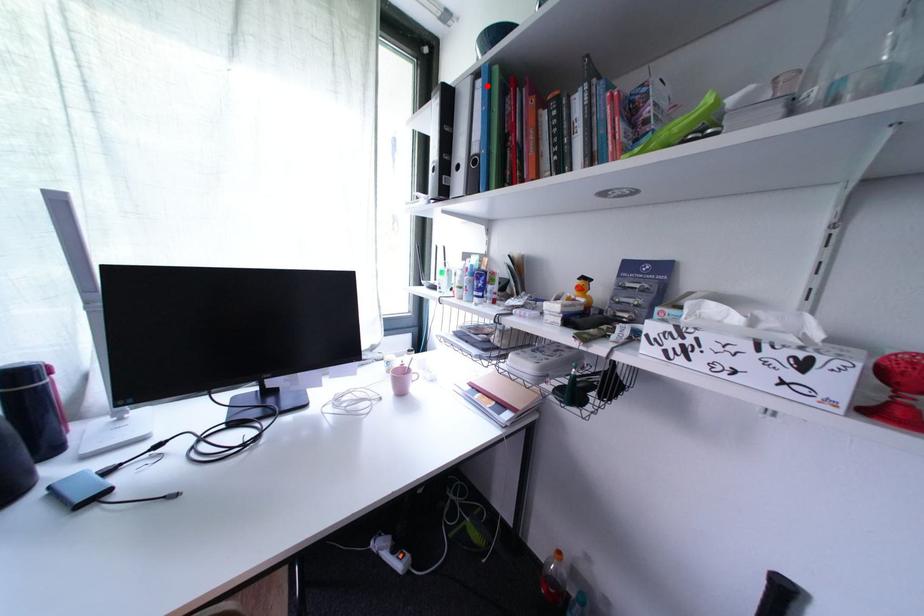
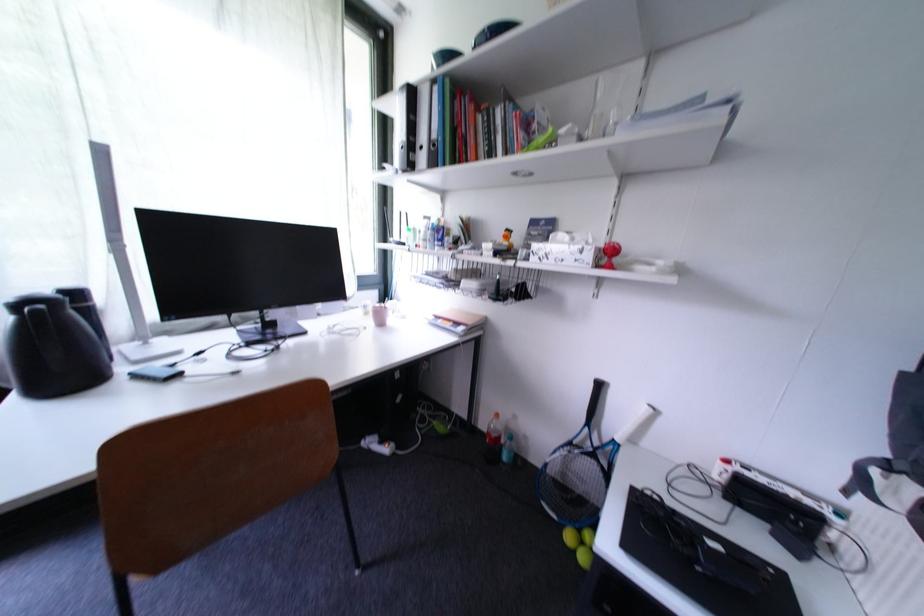
Locate, in the second image, the point that corresponds to the highlighted location in the first image.

(444, 91)